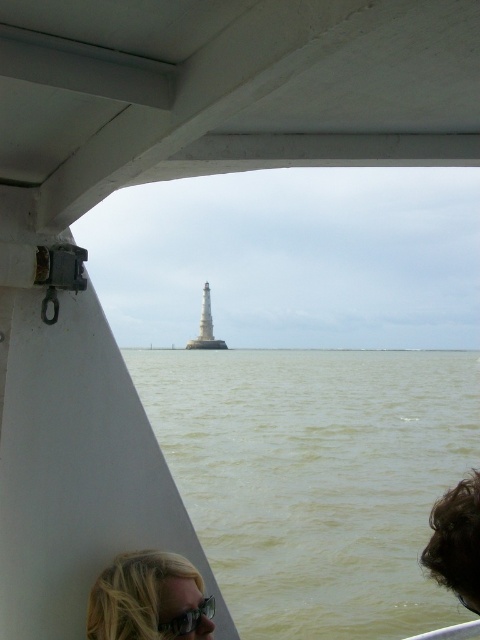
Question: Is blonde hair at lower left to the left of clear plastic goggles at lower center from the viewer's perspective?

Choices:
 (A) yes
 (B) no

Answer: (A)

Question: Which point is farther to the camera?

Choices:
 (A) (320, 513)
 (B) (204, 326)
 (C) (156, 616)

Answer: (B)

Question: In this image, where is blonde hair at lower left located relative to clear plastic goggles at lower center?

Choices:
 (A) above
 (B) below

Answer: (A)

Question: Considering the real-world distances, which object is closest to the clear plastic goggles at lower center?

Choices:
 (A) blonde hair at lower left
 (B) greenish water at center

Answer: (A)

Question: Does clear plastic goggles at lower center have a larger size compared to white stone tower at center?

Choices:
 (A) yes
 (B) no

Answer: (B)

Question: Which of the following is the farthest from the observer?

Choices:
 (A) (199, 618)
 (B) (207, 342)
 (C) (285, 480)

Answer: (B)